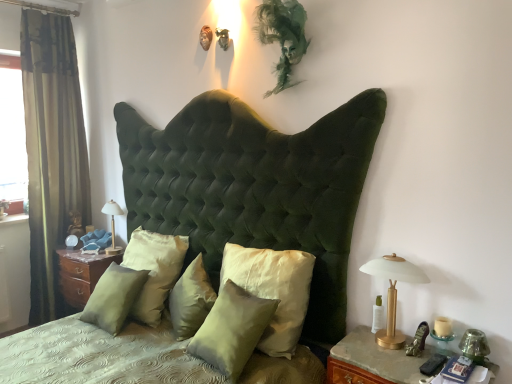
What are the coordinates of `free space to the left of gold metallic bedside lamp at right, which ranks as the 1th bedside lamp in right-to-left order` in the screenshot? It's located at (359, 348).